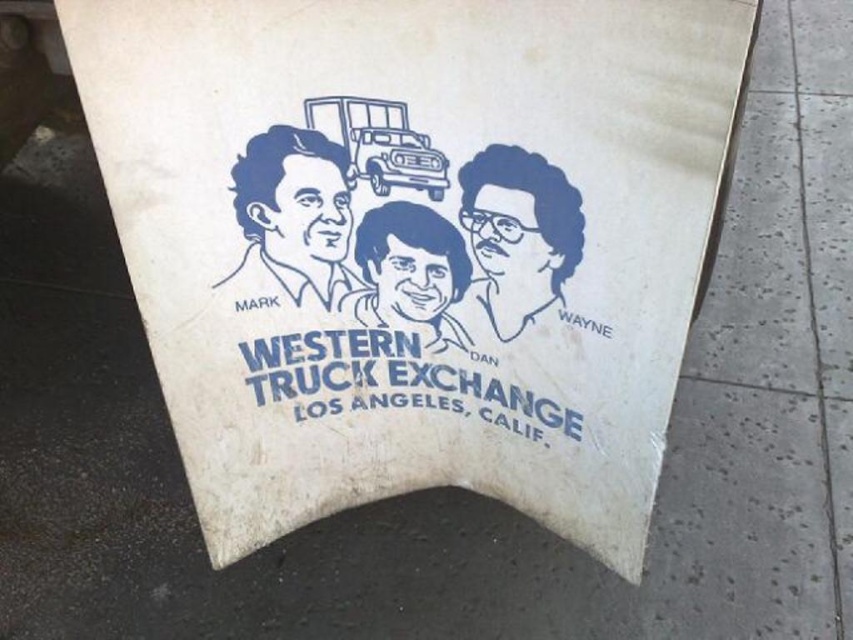
Question: Can you confirm if blue line drawing of man at center is bigger than blue line drawing face at upper center?

Choices:
 (A) yes
 (B) no

Answer: (B)

Question: Can you confirm if blue line drawing face at upper center is positioned to the right of matte blue head at center?

Choices:
 (A) no
 (B) yes

Answer: (B)

Question: Is blue line drawing of man at center in front of matte blue head at center?

Choices:
 (A) no
 (B) yes

Answer: (B)

Question: Estimate the real-world distances between objects in this image. Which object is closer to the blue line drawing face at upper center?

Choices:
 (A) blue line drawing of man at center
 (B) matte blue head at center

Answer: (B)

Question: Which point is farther to the camera?

Choices:
 (A) matte blue head at center
 (B) blue line drawing face at upper center

Answer: (A)

Question: Which object is the farthest from the blue line drawing of man at center?

Choices:
 (A) matte blue head at center
 (B) blue line drawing face at upper center

Answer: (B)